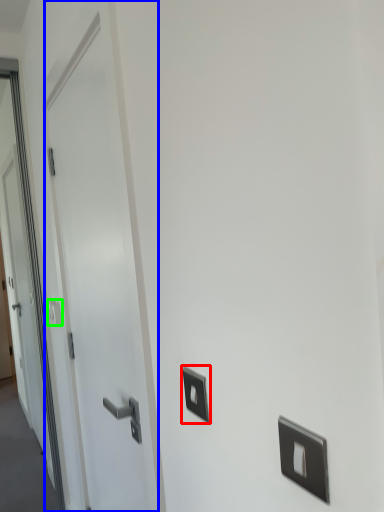
Question: Which is farther away from light switch (highlighted by a red box)? door (highlighted by a blue box) or light switch (highlighted by a green box)?

Choices:
 (A) door
 (B) light switch

Answer: (B)